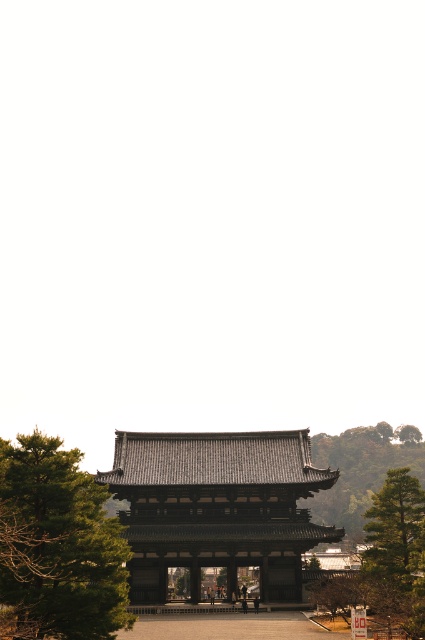
Question: Can you confirm if dark gray tiled gate at center is thinner than green leafy tree at left?

Choices:
 (A) no
 (B) yes

Answer: (A)

Question: Where is dark gray tiled gate at center located in relation to green textured tree at upper right in the image?

Choices:
 (A) left
 (B) right

Answer: (A)

Question: Among these points, which one is nearest to the camera?

Choices:
 (A) (23, 579)
 (B) (357, 518)

Answer: (A)

Question: Is dark gray tiled gate at center below green textured tree at upper right?

Choices:
 (A) no
 (B) yes

Answer: (A)

Question: Which object is farther from the camera taking this photo?

Choices:
 (A) green textured tree at upper right
 (B) green leafy tree at left
 (C) dark gray tiled gate at center

Answer: (A)

Question: Which of the following is the closest to the observer?

Choices:
 (A) [316, 497]
 (B) [173, 509]

Answer: (B)